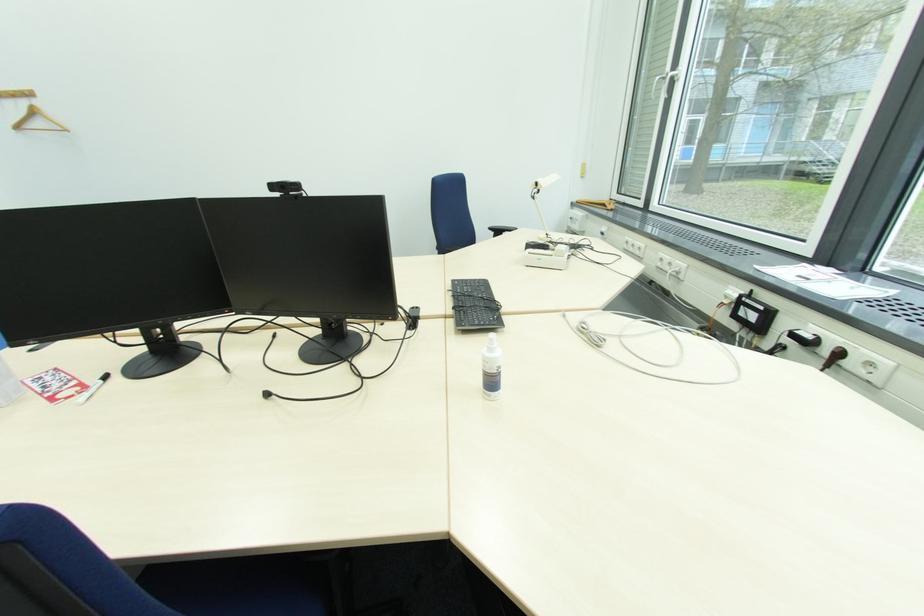
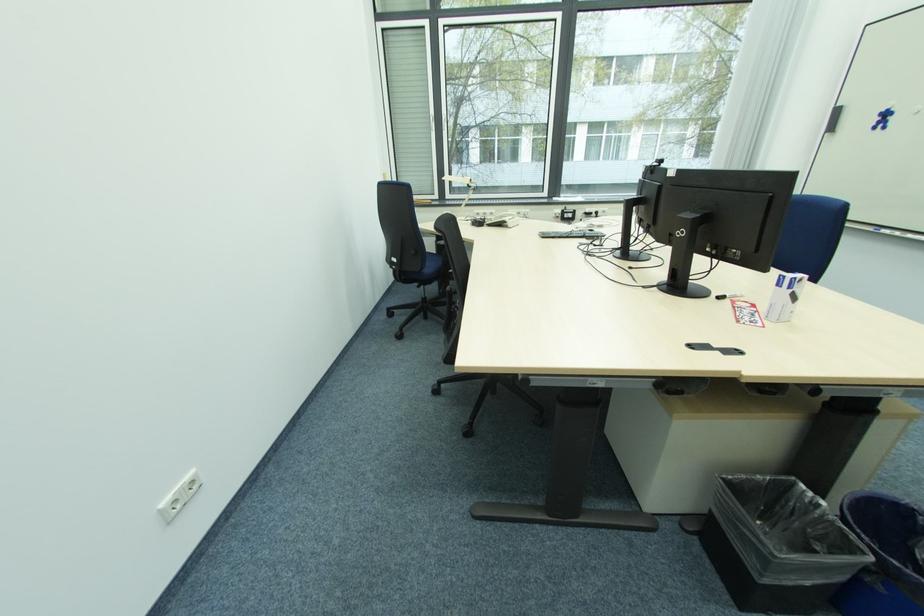
Question: I am providing you with two images of the same scene from different viewpoints. After the viewpoint changes to image2, which objects are now occluded?

Choices:
 (A) sewing machine cover
 (B) blue trash can
 (C) white telephone
 (D) black webcam

Answer: (D)